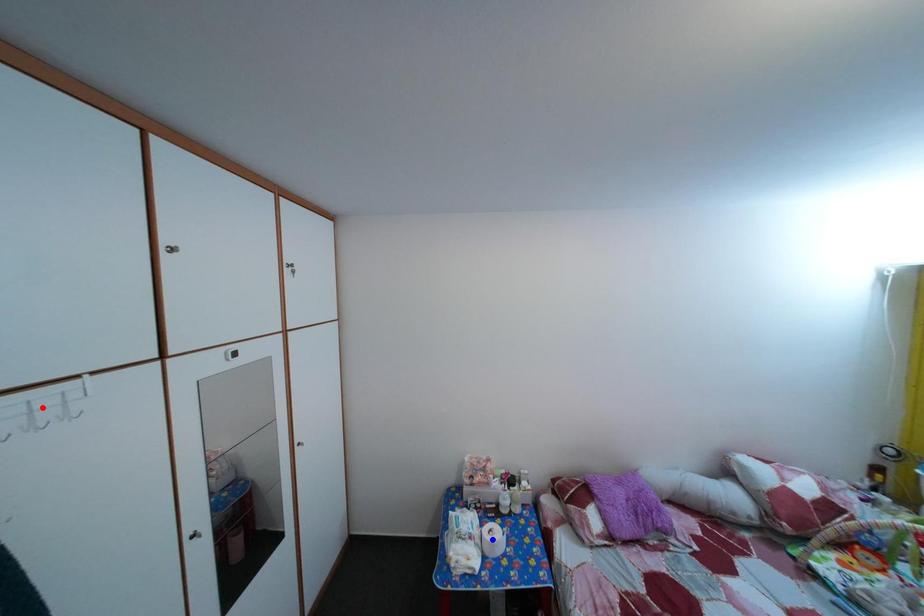
Question: In the image, two points are highlighted. Which point is nearer to the camera? Reply with the corresponding letter.

Choices:
 (A) blue point
 (B) red point

Answer: (B)